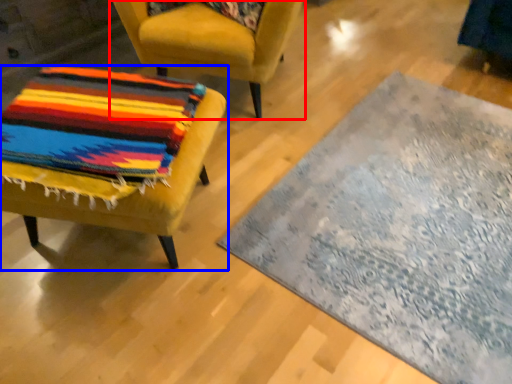
Question: Which point is closer to the camera, chair (highlighted by a red box) or chair (highlighted by a blue box)?

Choices:
 (A) chair
 (B) chair

Answer: (B)